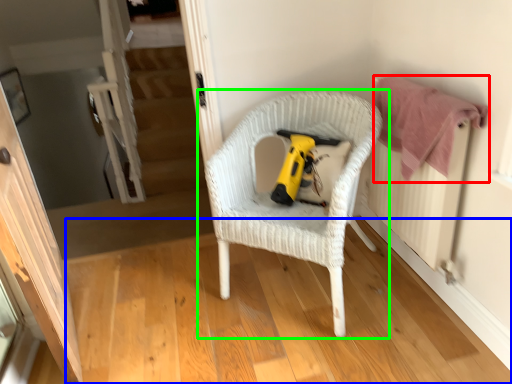
Question: Which is farther away from clothe (highlighted by a red box)? wood (highlighted by a blue box) or chair (highlighted by a green box)?

Choices:
 (A) wood
 (B) chair

Answer: (A)